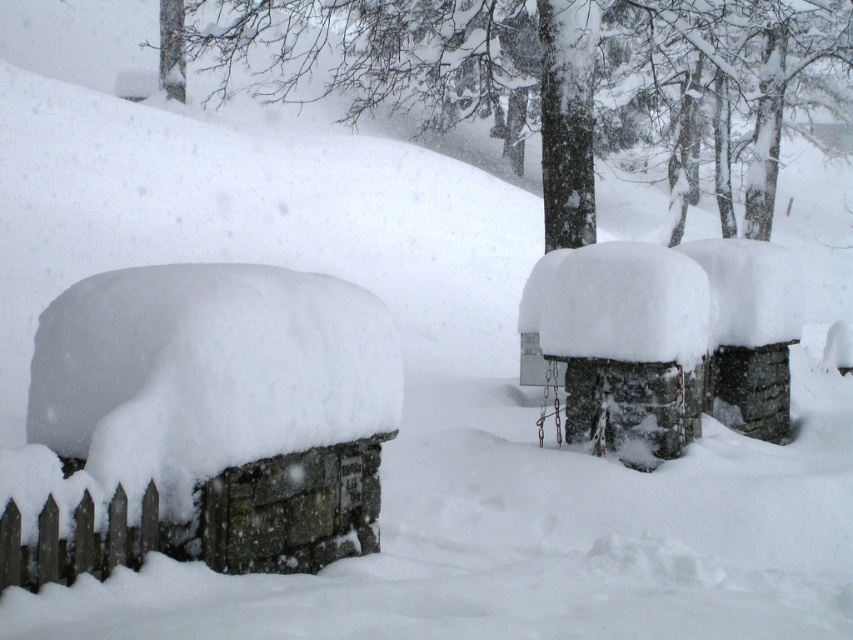
Does snow-covered tree at upper center have a greater width compared to brown wooden fence at lower left?

Yes, snow-covered tree at upper center is wider than brown wooden fence at lower left.

In the scene shown: Which is more to the right, snow-covered tree at upper center or brown wooden fence at lower left?

snow-covered tree at upper center

Based on the photo, who is more distant from viewer, (677, 64) or (228, 522)?

The point (677, 64) is behind.

Locate an element on the screen. The width and height of the screenshot is (853, 640). snow-covered tree at upper center is located at coordinates tap(556, 76).